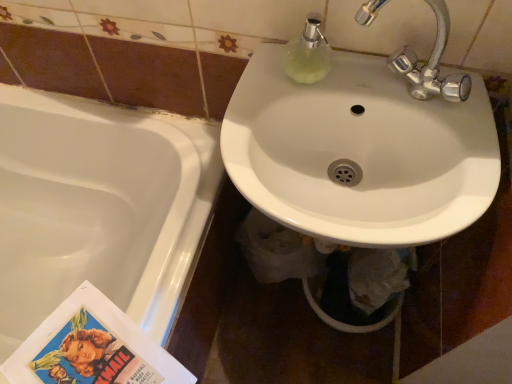
You are a GUI agent. You are given a task and a screenshot of the screen. Output one action in this format:
    pyautogui.click(x=<x>, y=<y>)
    Task: Click on the vacant space situated on the left part of translucent glass soap dispenser at upper center
    The image size is (512, 384).
    Given the screenshot: What is the action you would take?
    pyautogui.click(x=261, y=82)